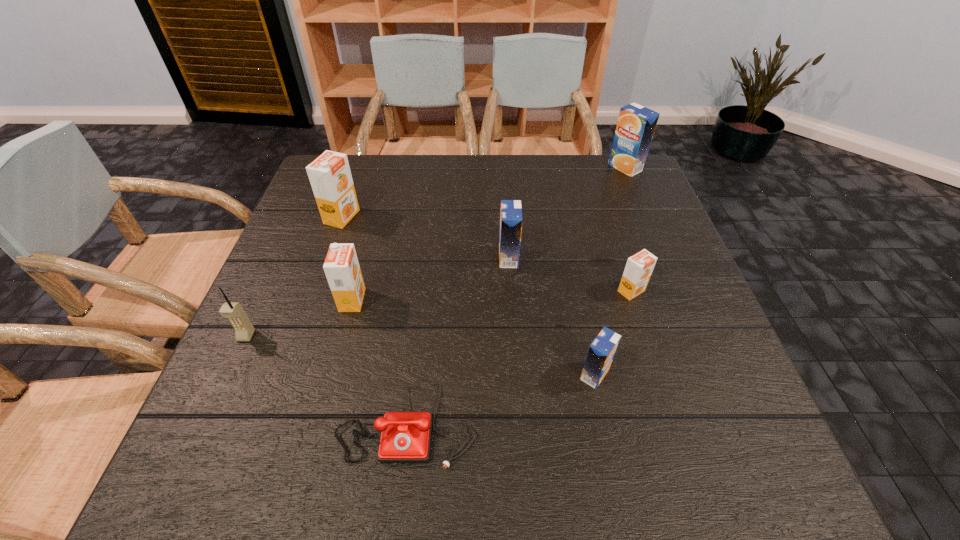
Find the location of a particular element. The height and width of the screenshot is (540, 960). the rightmost blue orange_juice is located at coordinates (636, 124).

Where is `the farthest orange juice`? The width and height of the screenshot is (960, 540). the farthest orange juice is located at coordinates (636, 124).

Locate an element on the screen. the leftmost orange juice is located at coordinates (329, 174).

The image size is (960, 540). I want to click on the leftmost orange orange juice, so click(x=329, y=174).

Where is `cellular telephone`? The height and width of the screenshot is (540, 960). cellular telephone is located at coordinates (244, 329).

Where is `the sixth farthest object`? the sixth farthest object is located at coordinates (244, 329).

Locate an element on the screen. This screenshot has height=540, width=960. the leftmost blue orange_juice is located at coordinates (511, 219).

You are a GUI agent. You are given a task and a screenshot of the screen. Output one action in this format:
    pyautogui.click(x=<x>, y=<y>)
    Task: Click on the fifth object from left to right
    The height and width of the screenshot is (540, 960).
    Given the screenshot: What is the action you would take?
    pyautogui.click(x=511, y=219)

Locate an element on the screen. The image size is (960, 540). the second orange orange juice from right to left is located at coordinates (341, 266).

Where is `the second orange juice from left to right`? This screenshot has height=540, width=960. the second orange juice from left to right is located at coordinates (341, 266).